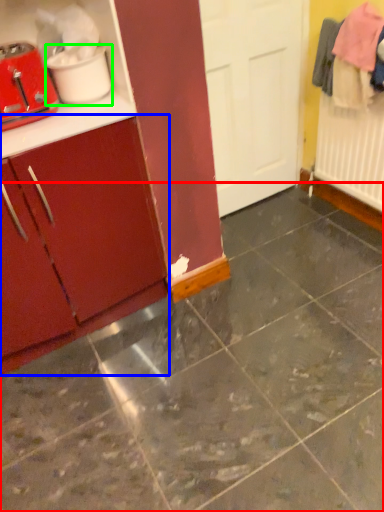
Question: Which object is the closest to the concrete (highlighted by a red box)? Choose among these: cabinetry (highlighted by a blue box) or appliance (highlighted by a green box).

Choices:
 (A) cabinetry
 (B) appliance

Answer: (A)